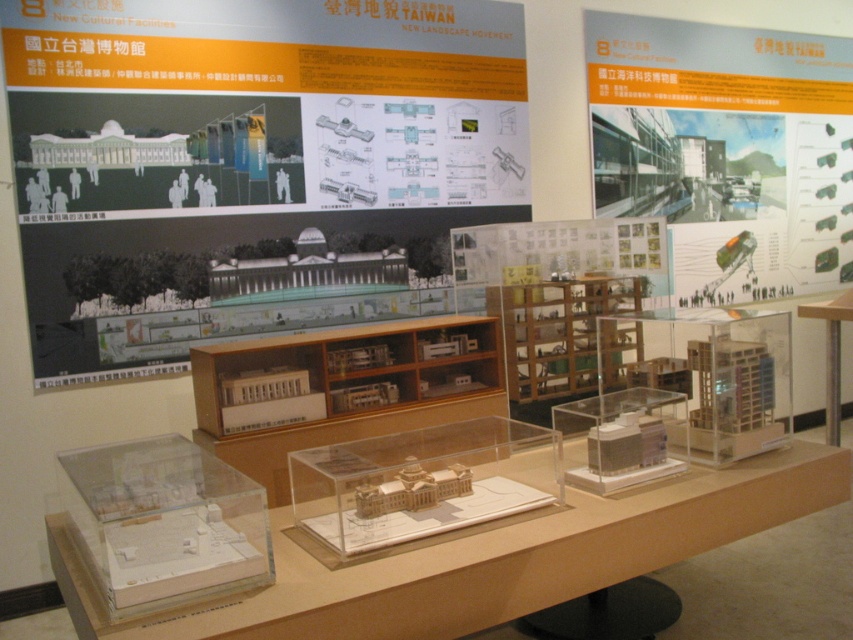
Question: Which of the following is the closest to the observer?

Choices:
 (A) matte white poster at upper center
 (B) clear plastic model at center

Answer: (B)

Question: Does transparent plastic model building at center appear under transparent plastic table at center?

Choices:
 (A) yes
 (B) no

Answer: (A)

Question: Is transparent plastic model building at center smaller than transparent plastic table at center?

Choices:
 (A) yes
 (B) no

Answer: (B)

Question: Which of the following is the farthest from the observer?

Choices:
 (A) transparent plastic table at center
 (B) clear plastic model at center
 (C) clear acrylic table at center

Answer: (A)

Question: Which is farther from the matte white building at upper right?

Choices:
 (A) transparent plastic table at center
 (B) matte white poster at upper center
 (C) clear plastic model at center
 (D) transparent plastic model building at center

Answer: (C)

Question: Does matte white poster at upper center appear on the right side of clear plastic model at center?

Choices:
 (A) no
 (B) yes

Answer: (B)